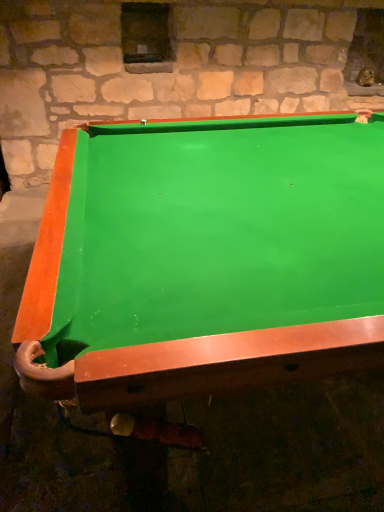
Where is `green felt pool table at center`? This screenshot has width=384, height=512. green felt pool table at center is located at coordinates 205,260.

What do you see at coordinates (205, 260) in the screenshot?
I see `green felt pool table at center` at bounding box center [205, 260].

Locate an element on the screen. green felt pool table at center is located at coordinates (205, 260).